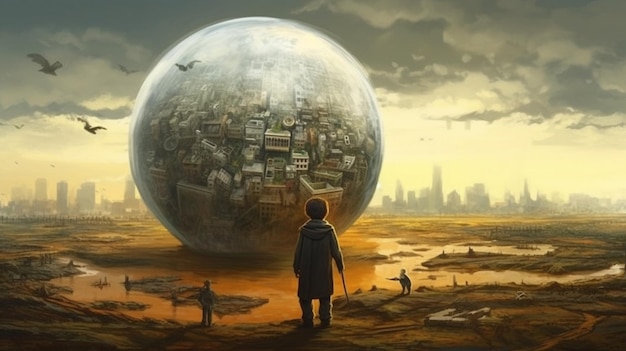
Identify the location of art. This screenshot has width=626, height=351. (394, 140).